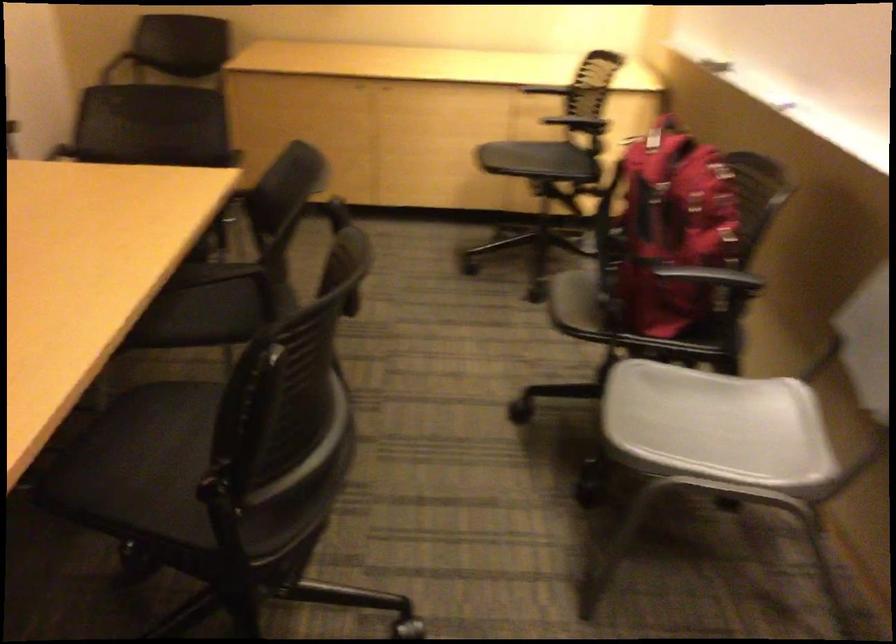
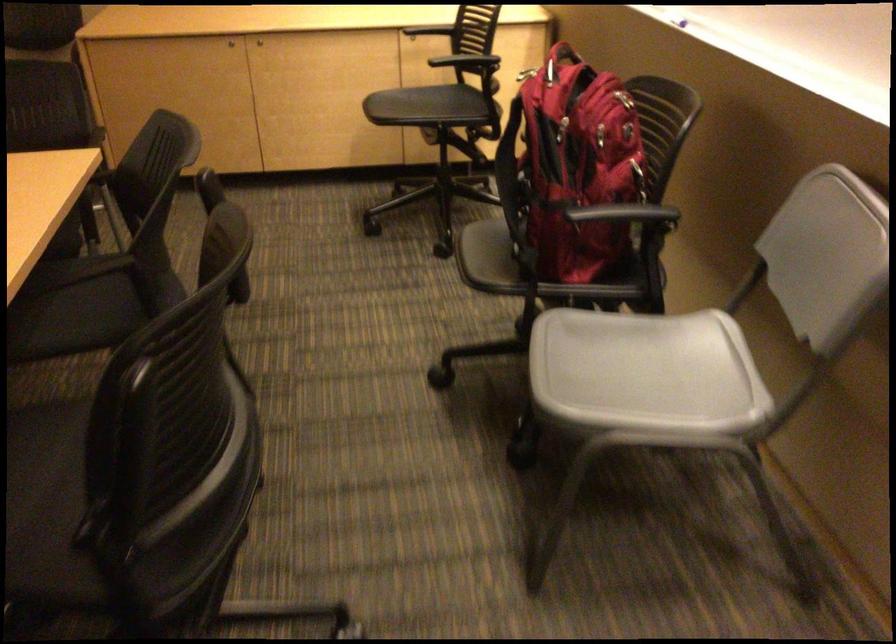
Find the pixel in the second image that matches the point at 207,272 in the first image.

(74, 270)